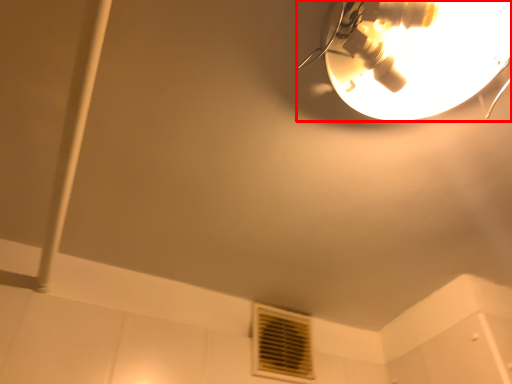
Question: From the image's perspective, where is lamp (annotated by the red box) located in relation to air conditioning in the image?

Choices:
 (A) below
 (B) above

Answer: (B)